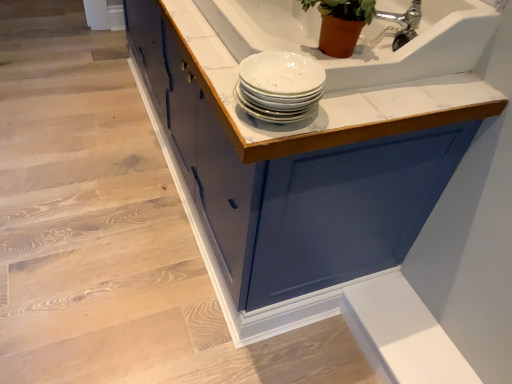
Question: From the image's perspective, is matte blue cabinet at upper center positioned above or below white glossy countertop at upper center?

Choices:
 (A) above
 (B) below

Answer: (A)

Question: Is matte blue cabinet at upper center in front of or behind white glossy countertop at upper center in the image?

Choices:
 (A) front
 (B) behind

Answer: (A)

Question: Which of these objects is positioned farthest from the white glossy plates at upper center?

Choices:
 (A) silver metallic faucet at upper right
 (B) matte blue cabinet at upper center
 (C) white glossy countertop at upper center

Answer: (B)

Question: Estimate the real-world distances between objects in this image. Which object is closer to the white glossy countertop at upper center?

Choices:
 (A) white glossy plates at upper center
 (B) silver metallic faucet at upper right
 (C) matte blue cabinet at upper center

Answer: (A)